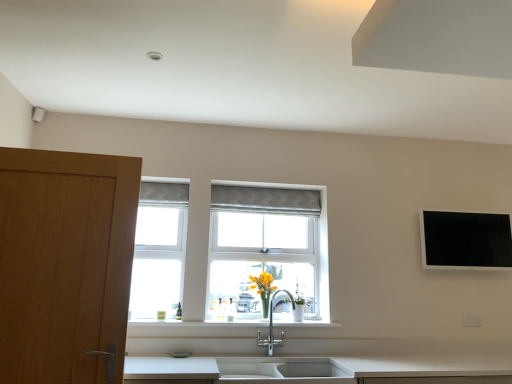
Measure the distance between textured gray curtain at center and camera.

They are 3.15 meters apart.

Image resolution: width=512 pixels, height=384 pixels. What are the coordinates of `white ceramic sink at lower center` in the screenshot? It's located at (281, 370).

What is the approximate height of white ceramic sink at lower center?

white ceramic sink at lower center is 5.85 inches in height.

What do you see at coordinates (65, 263) in the screenshot? This screenshot has width=512, height=384. I see `wooden door at left` at bounding box center [65, 263].

At what (x,y) coordinates should I click in order to perform the action: click on textured gray curtain at center. Please return your answer as a coordinate pair (x, y). Looking at the image, I should click on (265, 199).

Between wooden door at left and white plastic window frame at left, which one has larger size?

wooden door at left.

From the picture: Is wooden door at left positioned beyond the bounds of white plastic window frame at left?

wooden door at left is positioned outside white plastic window frame at left.

Who is more distant, wooden door at left or white plastic window frame at left?

white plastic window frame at left is further from the camera.

Between wooden door at left and white plastic window frame at left, which one has less height?

With less height is white plastic window frame at left.

Is white plastic window frame at left further to the viewer compared to white ceramic sink at lower center?

That is True.

Considering the positions of points (177, 301) and (336, 368), is point (177, 301) farther from camera compared to point (336, 368)?

Yes, point (177, 301) is behind point (336, 368).

The width and height of the screenshot is (512, 384). I want to click on sink that appears on the right of wooden door at left, so click(281, 370).

Between wooden door at left and white ceramic sink at lower center, which one has smaller size?

white ceramic sink at lower center.

Considering their positions, is wooden door at left located in front of or behind white ceramic sink at lower center?

Visually, wooden door at left is located in front of white ceramic sink at lower center.

From the image's perspective, is textured gray curtain at center below white plastic window frame at left?

Incorrect, from the image's perspective, textured gray curtain at center is higher than white plastic window frame at left.

Considering the relative sizes of textured gray curtain at center and white plastic window frame at left in the image provided, is textured gray curtain at center taller than white plastic window frame at left?

In fact, textured gray curtain at center may be shorter than white plastic window frame at left.

Looking at this image, is textured gray curtain at center located outside white plastic window frame at left?

textured gray curtain at center is positioned outside white plastic window frame at left.

From a real-world perspective, is textured gray curtain at center on white plastic window frame at left?

Yes, from a real-world perspective, textured gray curtain at center is on top of white plastic window frame at left.

Which is correct: textured gray curtain at center is inside white plastic electric outlet at lower right, or outside of it?

textured gray curtain at center is not enclosed by white plastic electric outlet at lower right.

Is textured gray curtain at center in front of white plastic electric outlet at lower right?

No, the depth of textured gray curtain at center is greater than that of white plastic electric outlet at lower right.

Considering the positions of objects textured gray curtain at center and white plastic electric outlet at lower right in the image provided, who is more to the right, textured gray curtain at center or white plastic electric outlet at lower right?

white plastic electric outlet at lower right.

Are textured gray curtain at center and white plastic electric outlet at lower right located far from each other?

Indeed, textured gray curtain at center is not near white plastic electric outlet at lower right.

Which is in front, black glossy flat screen tv at upper right or white plastic electric outlet at lower right?

black glossy flat screen tv at upper right is in front.

What's the angular difference between black glossy flat screen tv at upper right and white plastic electric outlet at lower right's facing directions?

They differ by 0.136 degrees in their facing directions.

Which is nearer, (501, 225) or (471, 321)?

Point (501, 225) appears to be farther away from the viewer than point (471, 321).

Does black glossy flat screen tv at upper right have a greater height compared to white plastic electric outlet at lower right?

Correct, black glossy flat screen tv at upper right is much taller as white plastic electric outlet at lower right.

Is point (67, 241) positioned in front of point (463, 315)?

Yes, point (67, 241) is closer to viewer.

From the image's perspective, which one is positioned higher, wooden door at left or white plastic electric outlet at lower right?

wooden door at left appears higher in the image.

Is wooden door at left completely or partially outside of white plastic electric outlet at lower right?

Indeed, wooden door at left is completely outside white plastic electric outlet at lower right.

Considering the relative sizes of wooden door at left and white plastic electric outlet at lower right in the image provided, is wooden door at left shorter than white plastic electric outlet at lower right?

No.

Locate an element on the screen. cabinetry to the left of white plastic window frame at left is located at coordinates (65, 263).

Where is `sink that is in front of the white plastic window frame at left`? sink that is in front of the white plastic window frame at left is located at coordinates (281, 370).

Based on their spatial positions, is black glossy flat screen tv at upper right or white plastic window frame at left further from white plastic electric outlet at lower right?

The object further to white plastic electric outlet at lower right is white plastic window frame at left.

Looking at the image, which one is located closer to white plastic electric outlet at lower right, white plastic window frame at left or wooden door at left?

Among the two, white plastic window frame at left is located nearer to white plastic electric outlet at lower right.

Estimate the real-world distances between objects in this image. Which object is closer to white ceramic sink at lower center, white plastic window frame at left or black glossy flat screen tv at upper right?

white plastic window frame at left lies closer to white ceramic sink at lower center than the other object.

Looking at the image, which one is located closer to wooden door at left, white plastic electric outlet at lower right or black glossy flat screen tv at upper right?

black glossy flat screen tv at upper right is positioned closer to the anchor wooden door at left.

Based on their spatial positions, is textured gray curtain at center or white ceramic sink at lower center further from white plastic window frame at left?

Based on the image, white ceramic sink at lower center appears to be further to white plastic window frame at left.

From the picture: Looking at the image, which one is located closer to black glossy flat screen tv at upper right, textured gray curtain at center or white plastic electric outlet at lower right?

white plastic electric outlet at lower right lies closer to black glossy flat screen tv at upper right than the other object.

Looking at the image, which one is located further to white plastic window frame at left, black glossy flat screen tv at upper right or textured gray curtain at center?

The object further to white plastic window frame at left is black glossy flat screen tv at upper right.

From the image, which object appears to be nearer to wooden door at left, white plastic window frame at left or white plastic electric outlet at lower right?

white plastic window frame at left.

In order to click on window frame between wooden door at left and black glossy flat screen tv at upper right in this screenshot , I will do `click(159, 250)`.

Where is `window frame situated between wooden door at left and white plastic electric outlet at lower right from left to right`? Image resolution: width=512 pixels, height=384 pixels. window frame situated between wooden door at left and white plastic electric outlet at lower right from left to right is located at coordinates (159, 250).

In order to click on sink between white plastic window frame at left and white plastic electric outlet at lower right in the horizontal direction in this screenshot , I will do `click(281, 370)`.

Find the location of a particular element. sink between wooden door at left and black glossy flat screen tv at upper right is located at coordinates (281, 370).